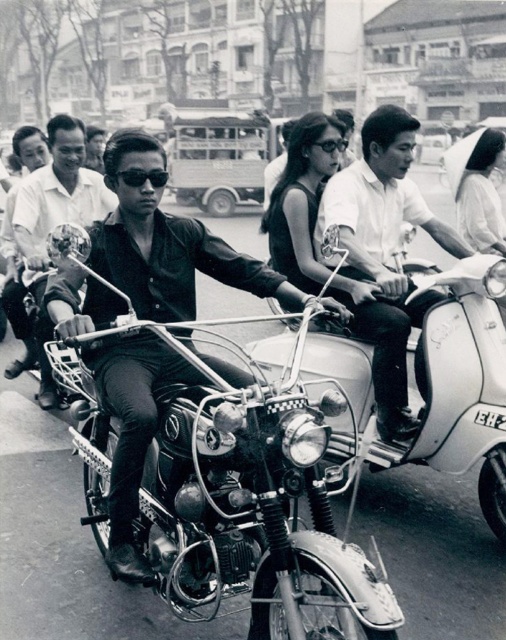
Question: Among these points, which one is nearest to the camera?

Choices:
 (A) (119, 173)
 (B) (140, 332)
 (C) (77, 131)
 (D) (320, 140)

Answer: (B)

Question: Is the position of shiny black shirt at center less distant than that of black plastic goggles at center?

Choices:
 (A) yes
 (B) no

Answer: (A)

Question: Is black matte sunglasses at center wider than black plastic goggles at center?

Choices:
 (A) no
 (B) yes

Answer: (A)

Question: Which of the following is the closest to the observer?

Choices:
 (A) shiny black shirt at center
 (B) black plastic goggles at center
 (C) metallic chrome motorcycle at center

Answer: (C)

Question: Which object is the closest to the black matte sunglasses at center?

Choices:
 (A) white matte shirt at center
 (B) metallic chrome motorcycle at center

Answer: (B)

Question: Can you confirm if white matte shirt at center is bigger than black plastic goggles at center?

Choices:
 (A) no
 (B) yes

Answer: (A)